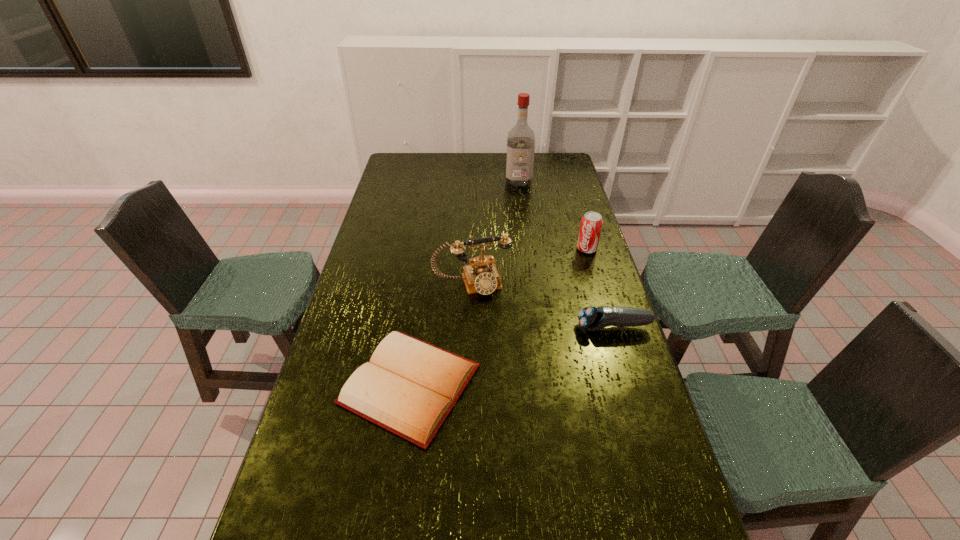
The image size is (960, 540). In order to click on vacant space on the desktop that is between the Bible and the electric shaver and is positioned on the logo side of the second farthest object in this screenshot , I will do `click(488, 362)`.

Find the location of a particular element. vacant space on the desktop that is between the Bible and the electric shaver and is positioned on the dial number of the fourth shortest object is located at coordinates (498, 360).

Identify the location of free space on the desktop that is between the shortest object and the second shortest object and is positioned on the front-facing side of the tallest object. (524, 353).